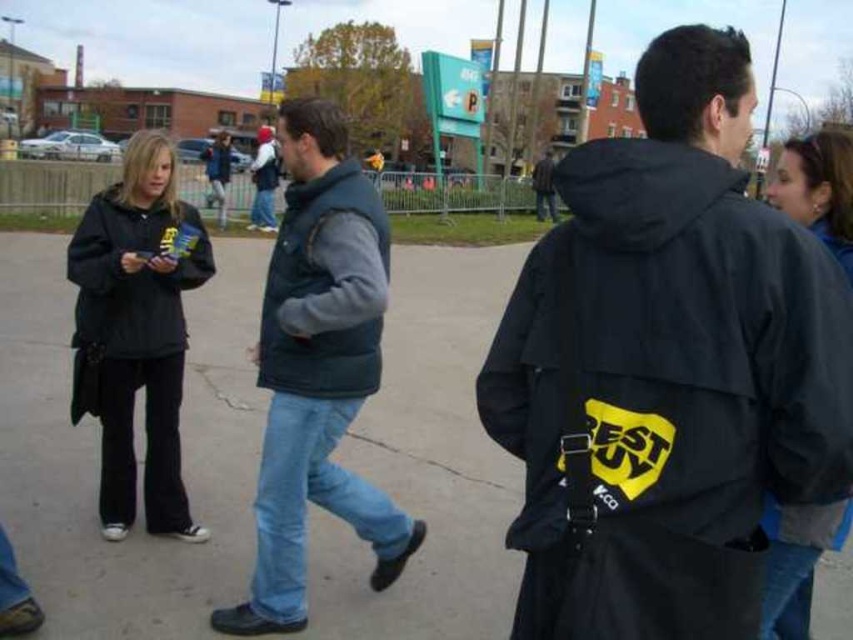
You are a photographer trying to capture a group photo of the dark gray jacket at upper right and the dark gray jacket at center. Which jacket should you focus on first to ensure they are both in frame?

The dark gray jacket at upper right has a lesser height compared to dark gray jacket at center, so you should focus on the dark gray jacket at center first to ensure both are in frame since it is taller and might be more visible.

You are standing at the origin point in the image. Which of the two points, point (821, 145) or point (535, 163), is closer to you?

Point (821, 145) is closer to the camera than point (535, 163), so it is closer to you.

You are a fashion designer analyzing the clothing items in the image. You need to determine which item is narrower between the black fabric jacket at center and the blue denim jeans at center. Which one is narrower?

The black fabric jacket at center is narrower than the blue denim jeans at center according to the description provided.